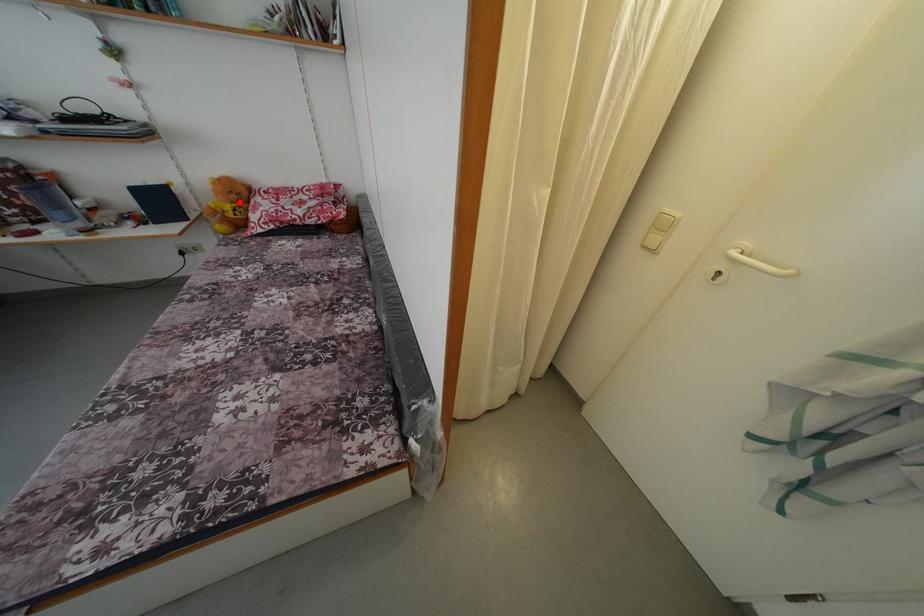
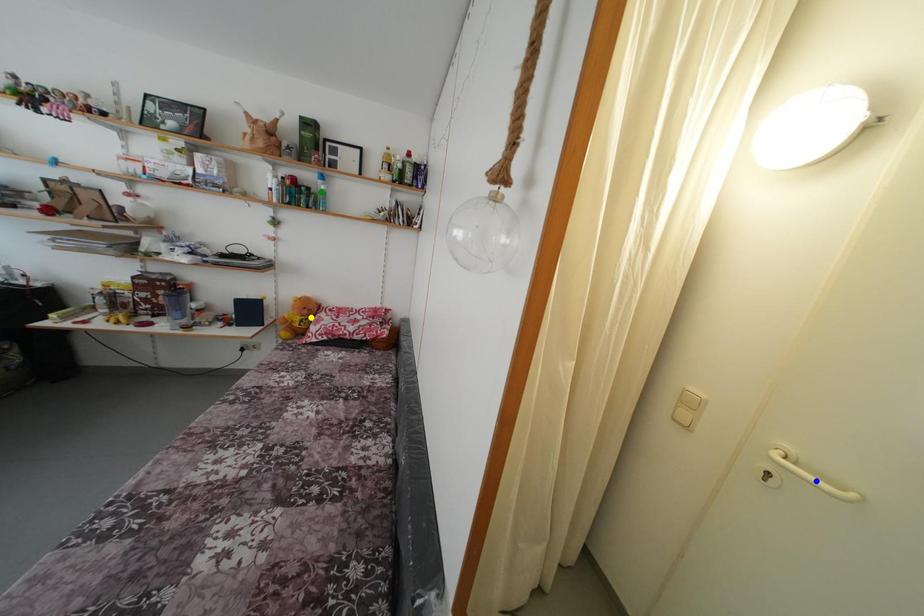
Question: I am providing you with two images of the same scene from different viewpoints. A red point is marked on the first image. You are given multiple points on the second image. Which mark in image 2 goes with the point in image 1?

Choices:
 (A) green point
 (B) yellow point
 (C) blue point

Answer: (B)